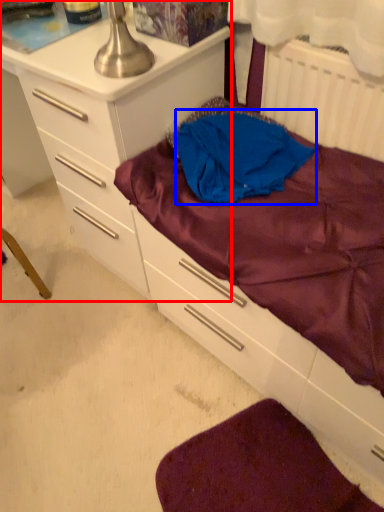
Question: Which object is further to the camera taking this photo, chest of drawers (highlighted by a red box) or clothing (highlighted by a blue box)?

Choices:
 (A) chest of drawers
 (B) clothing

Answer: (B)